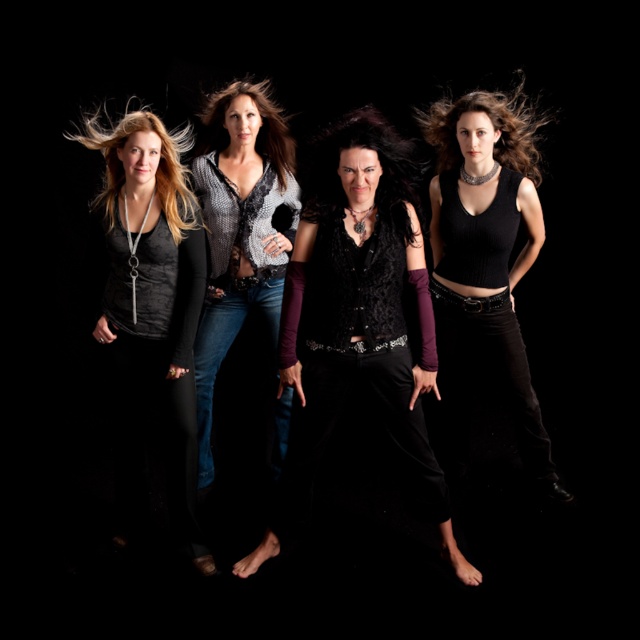
Question: Which object appears farthest from the camera in this image?

Choices:
 (A) black silky hair at center
 (B) blonde hair at center
 (C) knitted gray sweater at center
 (D) blonde silky hair at left

Answer: (B)

Question: Among these objects, which one is nearest to the camera?

Choices:
 (A) velvet black vest at center
 (B) blonde silky hair at left

Answer: (A)

Question: Can you confirm if black ribbed tank top at center is smaller than brownhair at center?

Choices:
 (A) no
 (B) yes

Answer: (A)

Question: Which point is closer to the camera?

Choices:
 (A) brownhair at center
 (B) black ribbed tank top at center
 (C) knitted gray sweater at center

Answer: (B)

Question: In this image, where is matte black top at left located relative to black silky hair at center?

Choices:
 (A) above
 (B) below

Answer: (B)

Question: Is matte black top at left positioned in front of black silky hair at center?

Choices:
 (A) yes
 (B) no

Answer: (B)